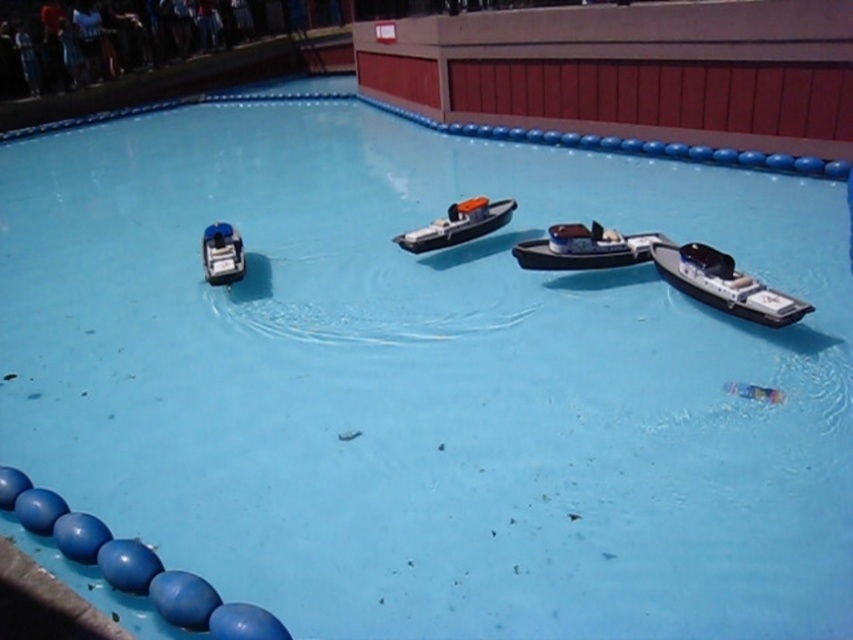
From the picture: Who is positioned more to the right, shiny silver boat at center or shiny blue toy boat at left?

From the viewer's perspective, shiny silver boat at center appears more on the right side.

Measure the distance between shiny silver boat at center and camera.

A distance of 5.00 meters exists between shiny silver boat at center and camera.

Describe the element at coordinates (584, 248) in the screenshot. The width and height of the screenshot is (853, 640). I see `shiny silver boat at center` at that location.

Find the location of a particular element. shiny silver boat at center is located at coordinates (584, 248).

Which of these two, shiny silver boat at center or orange matte boat at center, stands taller?

orange matte boat at center is taller.

Is shiny silver boat at center wider than orange matte boat at center?

Correct, the width of shiny silver boat at center exceeds that of orange matte boat at center.

Is point (627, 240) closer to camera compared to point (508, 209)?

Yes.

I want to click on shiny silver boat at center, so click(584, 248).

Is orange matte boat at center smaller than shiny blue toy boat at left?

Incorrect, orange matte boat at center is not smaller in size than shiny blue toy boat at left.

Does orange matte boat at center appear over shiny blue toy boat at left?

Yes, orange matte boat at center is above shiny blue toy boat at left.

Between point (495, 220) and point (202, 246), which one is positioned behind?

Positioned behind is point (495, 220).

You are a GUI agent. You are given a task and a screenshot of the screen. Output one action in this format:
    pyautogui.click(x=<x>, y=<y>)
    Task: Click on the orange matte boat at center
    This screenshot has width=853, height=640.
    Given the screenshot: What is the action you would take?
    (x=457, y=225)